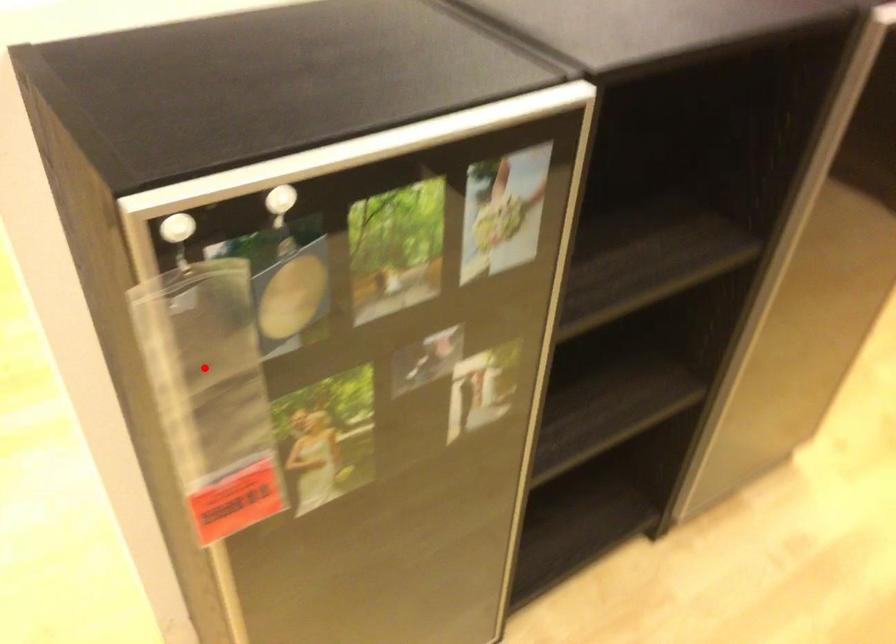
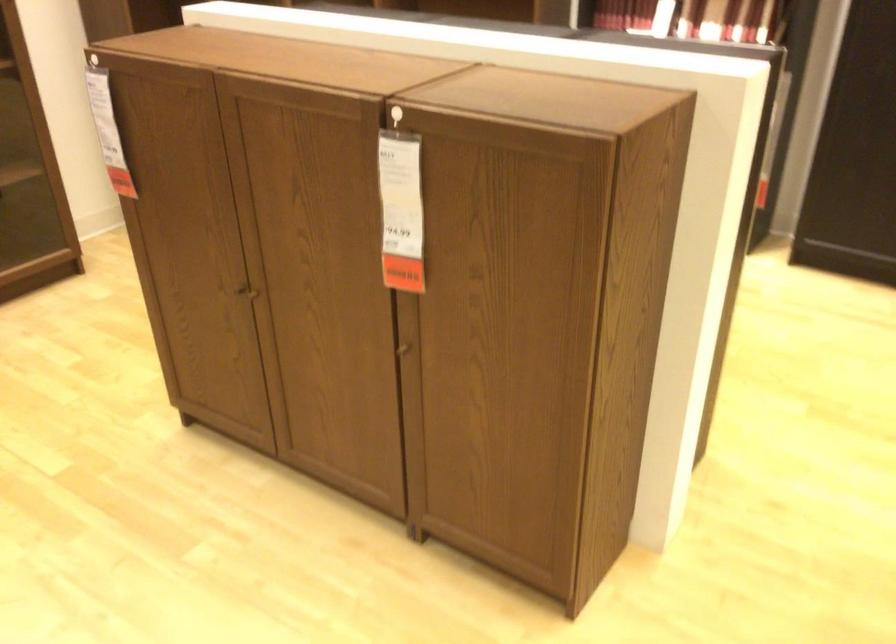
Question: I am providing you with two images of the same scene from different viewpoints. A red point is marked on the first image. At the location where the point appears in image 1, is it still visible in image 2?

Choices:
 (A) Yes
 (B) No

Answer: (B)